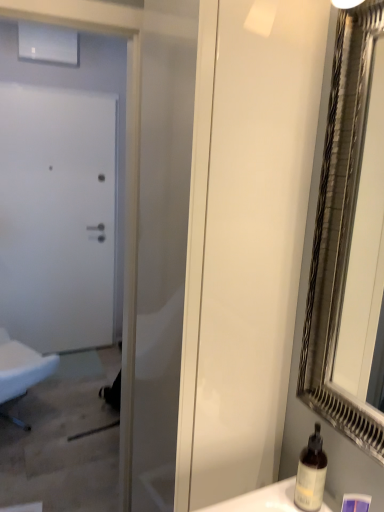
You are a GUI agent. You are given a task and a screenshot of the screen. Output one action in this format:
    pyautogui.click(x=<x>, y=<y>)
    Task: Click on the vacant space to the right of white fabric chair at left
    Image resolution: width=384 pixels, height=512 pixels.
    Given the screenshot: What is the action you would take?
    pyautogui.click(x=83, y=422)